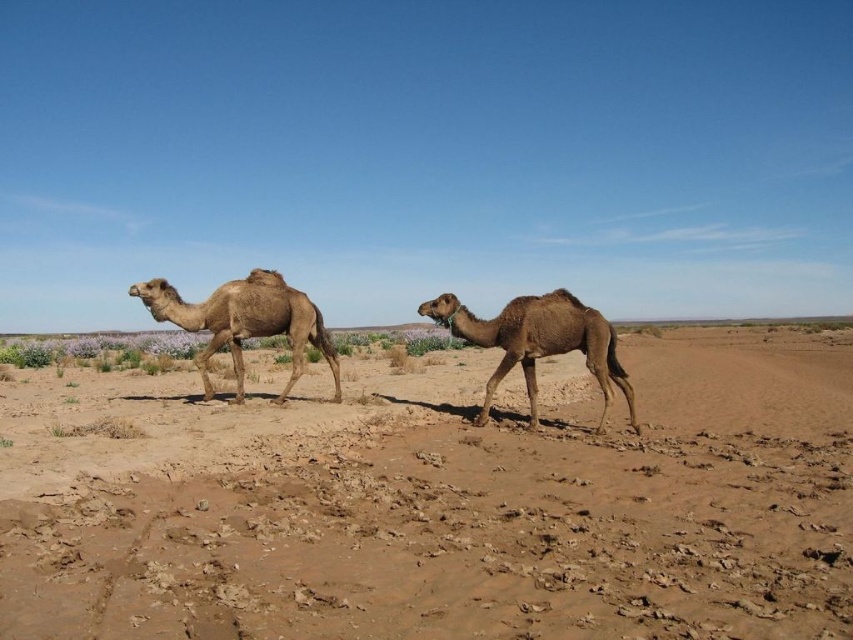
Question: Is brown sandy dirt at center smaller than desert tan camel at left?

Choices:
 (A) yes
 (B) no

Answer: (B)

Question: Which of the following is the farthest from the observer?

Choices:
 (A) (503, 314)
 (B) (374, 593)
 (C) (289, 317)

Answer: (C)

Question: Which point appears closest to the camera in this image?

Choices:
 (A) (328, 344)
 (B) (479, 342)
 (C) (521, 460)

Answer: (C)

Question: Which point appears closest to the camera in this image?

Choices:
 (A) (675, 636)
 (B) (604, 333)
 (C) (300, 301)

Answer: (A)

Question: Does brown matte camel at center have a smaller size compared to desert tan camel at left?

Choices:
 (A) no
 (B) yes

Answer: (A)

Question: Can you confirm if brown sandy dirt at center is thinner than brown matte camel at center?

Choices:
 (A) yes
 (B) no

Answer: (B)